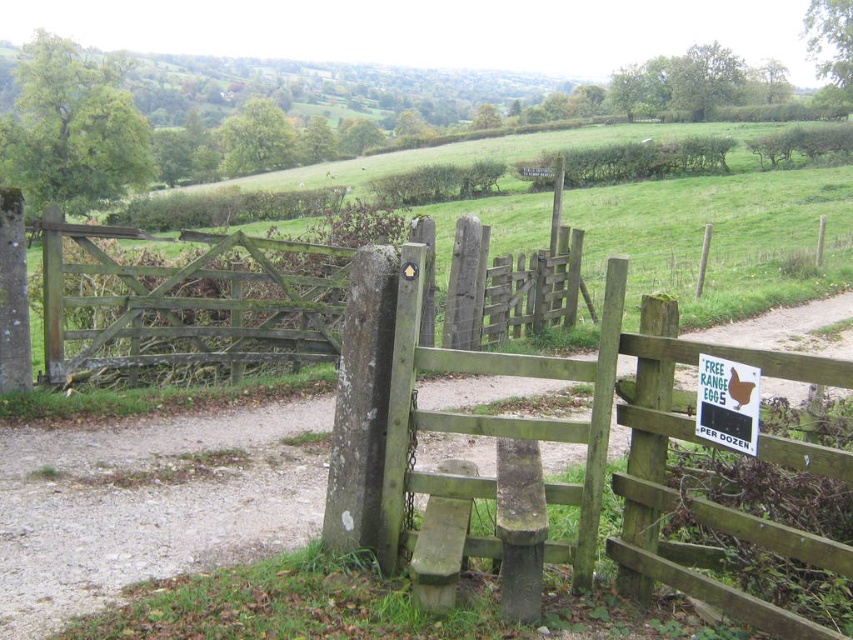
You are a farmer checking the entrance to your property. You have a ladder that is 1.5 meters tall. Can you determine if the ladder is tall enough to reach the top of the green mossy wood gate at center or the green plastic sign at center?

The green mossy wood gate at center is taller than the green plastic sign at center. Since the ladder is 1.5 meters tall, it depends on the actual height of the gate. However, the description only states the gate is taller than the sign but does not provide specific measurements. Therefore, we cannot definitively determine if the ladder is sufficient without additional information.

You are standing at the entrance of the field and see the point marked at coordinates (186, 301). What object is located at that point?

The point at coordinates (186, 301) marks the green mossy wood gate at center.